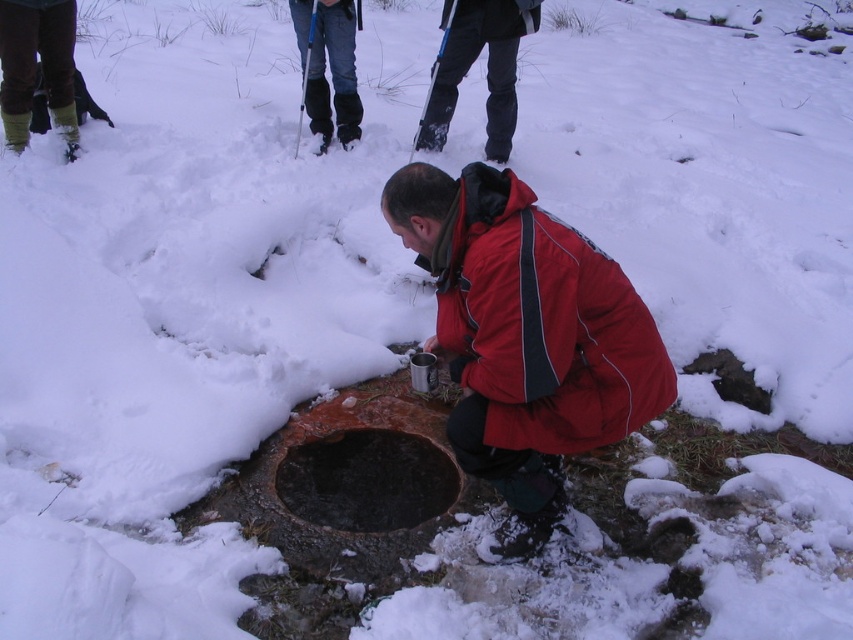
You are a photographer trying to capture both the red matte jacket at center and the black matte jacket at upper center in a single frame. Based on their sizes, which jacket will appear larger in your photo?

The red matte jacket at center will appear larger in the photo since its width surpasses that of the black matte jacket at upper center.

You are a hiker who needs to place a marker between the red matte jacket at center and the dark brown stone hole at center. Which object should the marker be closer to if you want it to be closer to the taller object?

The marker should be closer to the red matte jacket at center because it is taller than the dark brown stone hole at center.

You are standing at point (540,323) in the snowy scene. What object is directly beneath your feet?

The red matte jacket at center is directly beneath your feet at point (540,323).